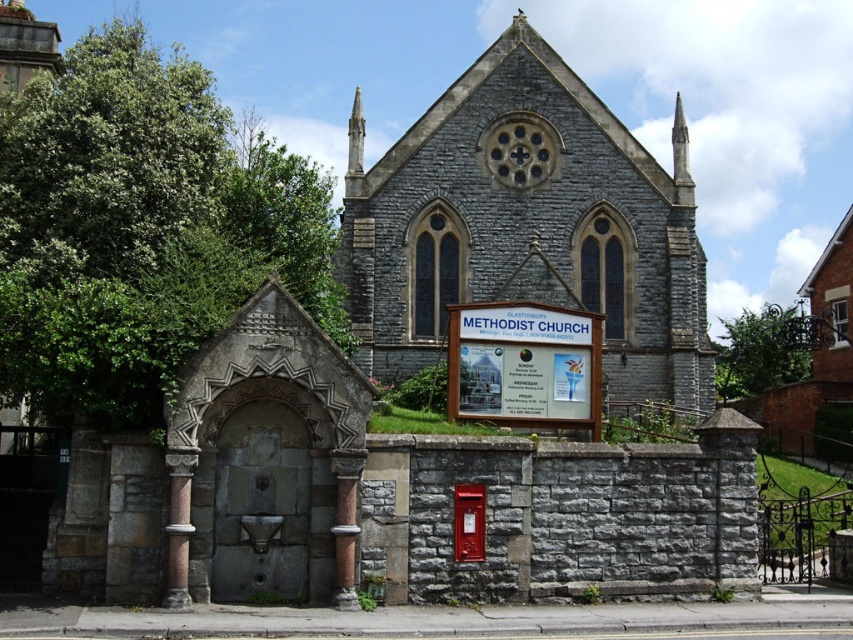
Between gray stone chapel at center and white wooden sign at center, which one has more height?

gray stone chapel at center

Which of these two, gray stone chapel at center or white wooden sign at center, stands shorter?

white wooden sign at center

Who is more forward, (438, 120) or (460, 369)?

Positioned in front is point (460, 369).

Where is `gray stone chapel at center`? This screenshot has width=853, height=640. gray stone chapel at center is located at coordinates (527, 228).

Between point (479, 390) and point (349, 161), which one is positioned behind?

Positioned behind is point (349, 161).

Based on the photo, does white wooden sign at center have a smaller size compared to smooth stone spire at upper center?

Yes.

Is point (512, 349) farther from camera compared to point (351, 120)?

No, (512, 349) is in front of (351, 120).

The height and width of the screenshot is (640, 853). I want to click on white wooden sign at center, so click(524, 364).

Between gray stone chapel at center and smooth stone spire at upper center, which one has more height?

Standing taller between the two is gray stone chapel at center.

In the scene shown: Is gray stone chapel at center taller than smooth stone spire at upper center?

Correct, gray stone chapel at center is much taller as smooth stone spire at upper center.

What do you see at coordinates (527, 228) in the screenshot? Image resolution: width=853 pixels, height=640 pixels. I see `gray stone chapel at center` at bounding box center [527, 228].

I want to click on gray stone chapel at center, so click(527, 228).